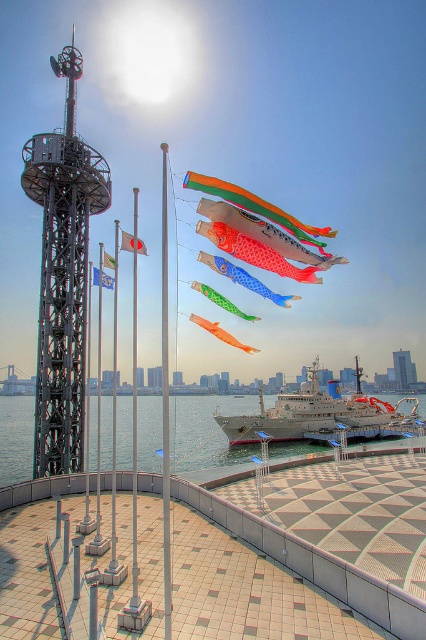
You are a photographer trying to capture the orange glossy fish at upper center and the blue glossy kite at center in a single frame. Given that your camera has a fixed focal length, which object should you focus on to ensure both are in the frame without cropping?

To include both the orange glossy fish at upper center and the blue glossy kite at center in the frame, focus on the orange glossy fish at upper center since it is larger and requires more space, ensuring the smaller blue glossy kite at center will also fit.

You are a photographer positioned at the center of the waterfront scene. You want to capture a photo that includes both the blue glossy kite at center and the white fabric flag at center. Based on their positions, which object should you adjust your camera to focus on first to ensure both are in frame?

The blue glossy kite at center is to the right of the white fabric flag at center. To ensure both are in frame, you should focus on the white fabric flag at center first, as it is positioned to the left, allowing the blue glossy kite at center to naturally come into view on the right side.

You are a photographer trying to capture the white fabric flag at center without the black metallic tower at center blocking it. Based on the scene, is this possible?

The white fabric flag at center is behind the black metallic tower at center, so it would be blocked by the tower. Therefore, it is not possible to capture the white fabric flag at center without the black metallic tower at center blocking it.